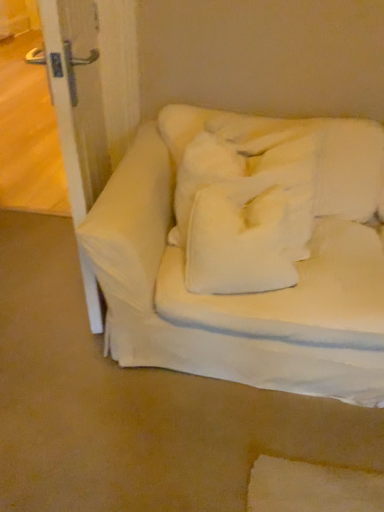
Question: In terms of width, does white soft pillow at center look wider or thinner when compared to white fabric couch at center?

Choices:
 (A) wide
 (B) thin

Answer: (B)

Question: From a real-world perspective, is white soft pillow at center above or below white fabric couch at center?

Choices:
 (A) above
 (B) below

Answer: (A)

Question: Estimate the real-world distances between objects in this image. Which object is closer to the white soft pillow at center?

Choices:
 (A) white soft pillow at center
 (B) white fabric couch at center

Answer: (A)

Question: Which of these objects is positioned closest to the white fabric couch at center?

Choices:
 (A) white soft pillow at center
 (B) white soft pillow at center

Answer: (A)